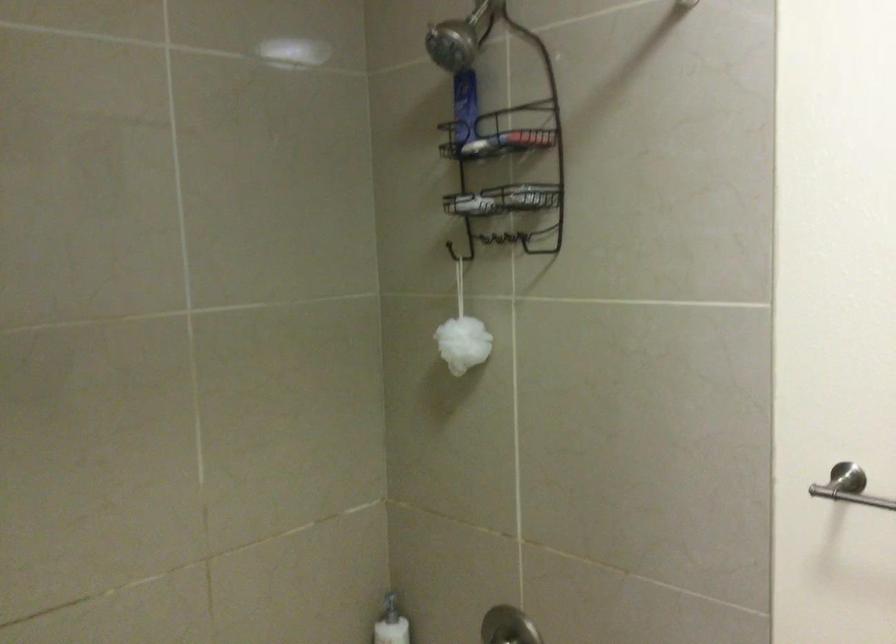
Locate an element on the screen. The width and height of the screenshot is (896, 644). chrome faucet handle is located at coordinates (506, 627).